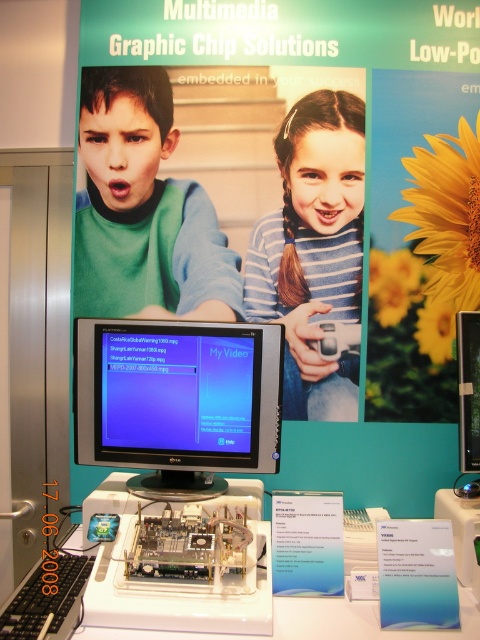
You are an attendee at the exhibition and want to check the video files on the computer monitor. You notice the blue striped shirt at center and the white plastic table at center. Which object is closer to the monitor?

The blue striped shirt at center is closer to the monitor than the white plastic table at center because it has a smaller size compared to the white plastic table at center.

You are a photographer at the exhibition and need to capture a wide shot of the satin black monitor at center and the blue striped shirt at center. Which object should you zoom in on to ensure both fit in the frame?

The satin black monitor at center is wider than the blue striped shirt at center, so you should zoom out to ensure both fit in the frame.